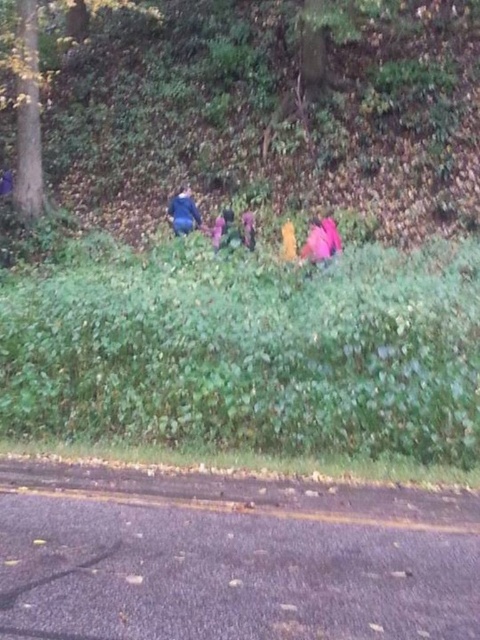
Can you confirm if green leafy vegetation at center is wider than green matte tree at upper left?

Yes, green leafy vegetation at center is wider than green matte tree at upper left.

Who is positioned more to the left, green leafy vegetation at center or green matte tree at upper left?

From the viewer's perspective, green matte tree at upper left appears more on the left side.

What do you see at coordinates (252, 353) in the screenshot? The width and height of the screenshot is (480, 640). I see `green leafy vegetation at center` at bounding box center [252, 353].

Locate an element on the screen. green leafy vegetation at center is located at coordinates (252, 353).

The image size is (480, 640). What do you see at coordinates (252, 353) in the screenshot?
I see `green leafy vegetation at center` at bounding box center [252, 353].

Is green leafy vegetation at center bigger than blue fabric jacket at upper center?

Correct, green leafy vegetation at center is larger in size than blue fabric jacket at upper center.

Does point (123, 266) come in front of point (196, 225)?

That is True.

I want to click on green leafy vegetation at center, so click(x=252, y=353).

Based on the photo, between green matte tree at upper left and blue fabric jacket at upper center, which one is positioned lower?

Positioned lower is blue fabric jacket at upper center.

Where is `green matte tree at upper left`? This screenshot has height=640, width=480. green matte tree at upper left is located at coordinates (24, 97).

At what (x,y) coordinates should I click in order to perform the action: click on green matte tree at upper left. Please return your answer as a coordinate pair (x, y). Looking at the image, I should click on (24, 97).